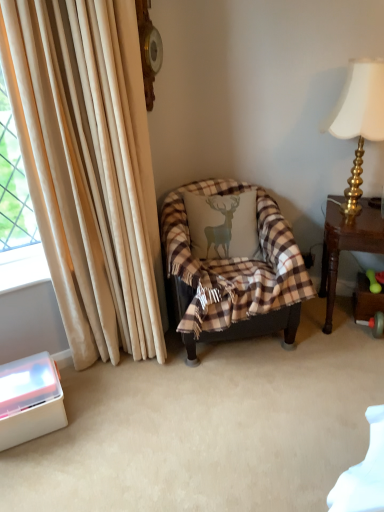
Question: From a real-world perspective, is white plastic container at lower left positioned under plaid fabric chair at center based on gravity?

Choices:
 (A) no
 (B) yes

Answer: (B)

Question: Is white plastic container at lower left oriented towards plaid fabric chair at center?

Choices:
 (A) yes
 (B) no

Answer: (B)

Question: From the image's perspective, is white plastic container at lower left beneath plaid fabric chair at center?

Choices:
 (A) no
 (B) yes

Answer: (B)

Question: Is the position of white plastic container at lower left more distant than that of plaid fabric chair at center?

Choices:
 (A) no
 (B) yes

Answer: (A)

Question: Does white plastic container at lower left have a lesser height compared to plaid fabric chair at center?

Choices:
 (A) yes
 (B) no

Answer: (A)

Question: Considering their positions, is plaid fabric pillow with deer design at center located in front of or behind beige velvet curtain at left?

Choices:
 (A) front
 (B) behind

Answer: (B)

Question: Looking at the image, does plaid fabric pillow with deer design at center seem bigger or smaller compared to beige velvet curtain at left?

Choices:
 (A) big
 (B) small

Answer: (B)

Question: Looking at their shapes, would you say plaid fabric pillow with deer design at center is wider or thinner than beige velvet curtain at left?

Choices:
 (A) thin
 (B) wide

Answer: (A)

Question: From a real-world perspective, is plaid fabric pillow with deer design at center above or below beige velvet curtain at left?

Choices:
 (A) below
 (B) above

Answer: (A)

Question: In the image, is white plastic container at lower left on the left side or the right side of brown wooden table at right?

Choices:
 (A) right
 (B) left

Answer: (B)

Question: From their relative heights in the image, would you say white plastic container at lower left is taller or shorter than brown wooden table at right?

Choices:
 (A) tall
 (B) short

Answer: (B)

Question: Is point pos(56,397) closer or farther from the camera than point pos(322,269)?

Choices:
 (A) farther
 (B) closer

Answer: (B)

Question: Is white plastic container at lower left bigger or smaller than brown wooden table at right?

Choices:
 (A) small
 (B) big

Answer: (A)

Question: From the image's perspective, is plaid fabric pillow with deer design at center above or below plaid fabric chair at center?

Choices:
 (A) below
 (B) above

Answer: (B)

Question: Considering the positions of plaid fabric pillow with deer design at center and plaid fabric chair at center in the image, is plaid fabric pillow with deer design at center taller or shorter than plaid fabric chair at center?

Choices:
 (A) short
 (B) tall

Answer: (A)